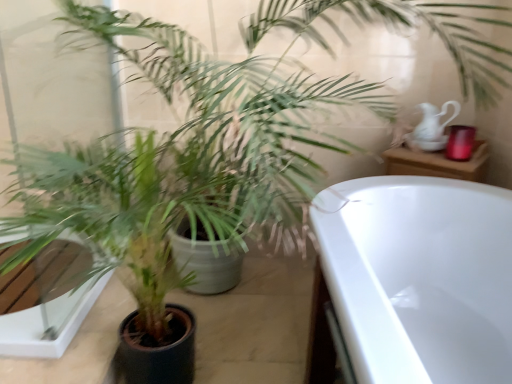
Question: Visually, is white glossy pitcher at upper right positioned to the left or to the right of green matte plant at center?

Choices:
 (A) left
 (B) right

Answer: (B)

Question: From a real-world perspective, is white glossy pitcher at upper right above or below green matte plant at center?

Choices:
 (A) above
 (B) below

Answer: (A)

Question: In terms of height, does white glossy pitcher at upper right look taller or shorter compared to green matte plant at center?

Choices:
 (A) tall
 (B) short

Answer: (B)

Question: From the image's perspective, relative to white glossy pitcher at upper right, is green matte plant at center above or below?

Choices:
 (A) below
 (B) above

Answer: (A)

Question: Is green matte plant at center inside or outside of white glossy pitcher at upper right?

Choices:
 (A) inside
 (B) outside

Answer: (B)

Question: Is point (117, 215) closer or farther from the camera than point (424, 120)?

Choices:
 (A) closer
 (B) farther

Answer: (A)

Question: Visually, is green matte plant at center positioned to the left or to the right of white glossy pitcher at upper right?

Choices:
 (A) right
 (B) left

Answer: (B)